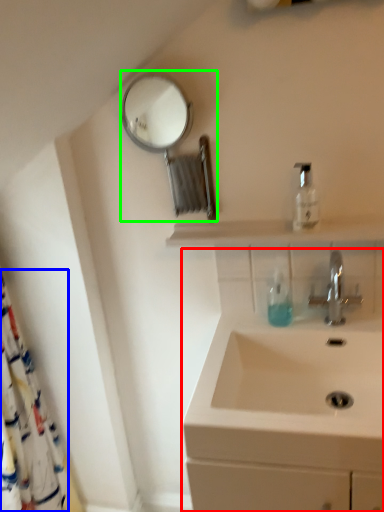
Question: Considering the real-world distances, which object is closest to sink (highlighted by a red box)? shower curtain (highlighted by a blue box) or mirror (highlighted by a green box).

Choices:
 (A) shower curtain
 (B) mirror

Answer: (A)